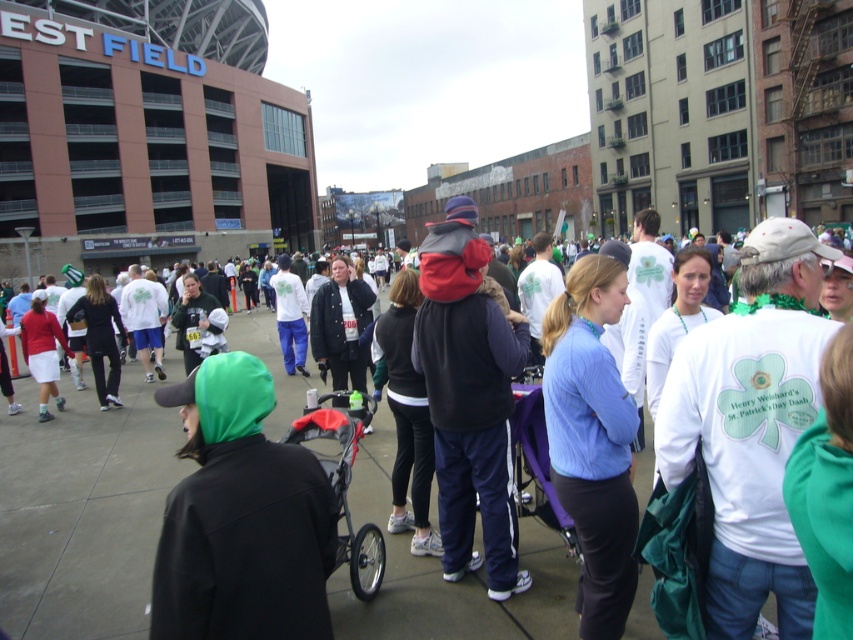
You are a photographer positioned at the front of the crowd, and you want to take a photo of both the matte black jacket at center and the dark blue fleece vest at center. Which object will appear larger in your photo?

The matte black jacket at center will appear larger in the photo because it is closer to the viewer than the dark blue fleece vest at center.

You are a photographer positioned at the edge of the event area, aiming to capture a photo of both the matte black jacket at center and the blue fleece jacket at center in the same frame. Given that your camera has a maximum focus range of 5 meters, will both jackets be in focus if you focus on the closer one?

The distance between the matte black jacket at center and blue fleece jacket at center is 5.65 meters. Since the camera can only focus within 5 meters, focusing on the closer one would leave the farther jacket beyond the focus range, resulting in it being out of focus.

You are organizing a St. Patrick Day event and need to arrange the green matte hood at center and the red plastic baby carriage at center along a narrow pathway. Given their widths, which item should be placed first to ensure they fit side by side?

The red plastic baby carriage at center should be placed first since it is narrower than the green matte hood at center, allowing both to fit side by side along the narrow pathway.